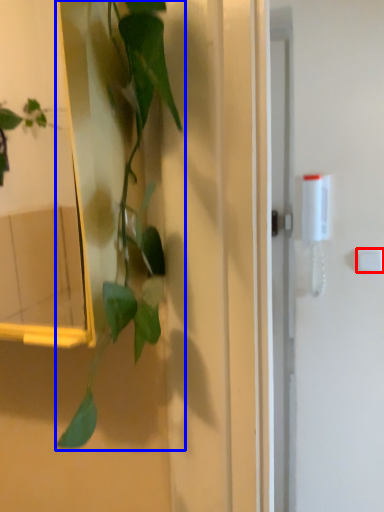
Question: Which of the following is the closest to the observer, light switch (highlighted by a red box) or houseplant (highlighted by a blue box)?

Choices:
 (A) light switch
 (B) houseplant

Answer: (B)